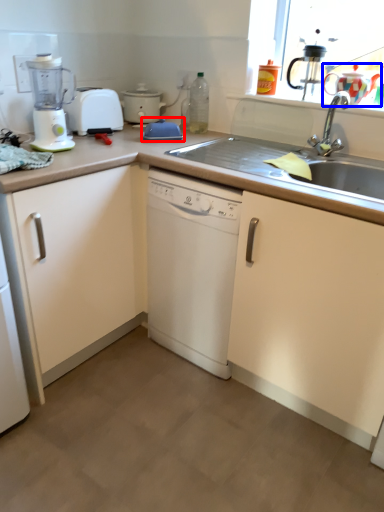
Question: Among these objects, which one is nearest to the camera, appliance (highlighted by a red box) or tea pot (highlighted by a blue box)?

Choices:
 (A) appliance
 (B) tea pot

Answer: (B)